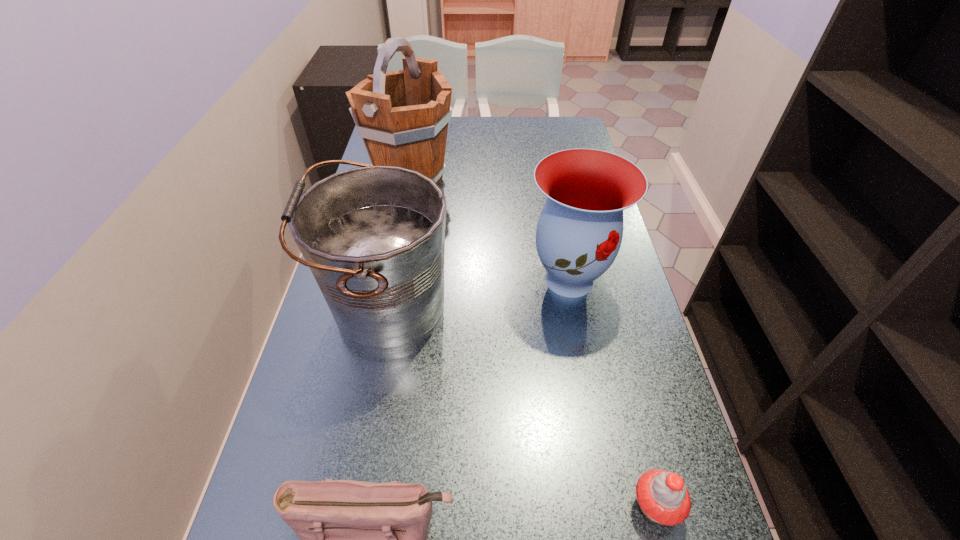
Image resolution: width=960 pixels, height=540 pixels. Find the location of `the farthest object`. the farthest object is located at coordinates (402, 116).

Find the location of a particular element. This screenshot has height=540, width=960. the tallest object is located at coordinates (402, 116).

Locate an element on the screen. This screenshot has height=540, width=960. the nearer bucket is located at coordinates (373, 237).

The height and width of the screenshot is (540, 960). I want to click on vase, so click(x=579, y=232).

Image resolution: width=960 pixels, height=540 pixels. I want to click on cupcake, so click(x=662, y=496).

This screenshot has width=960, height=540. In order to click on vacant space located 0.300m on the front of the farther bucket in this screenshot , I will do `click(391, 278)`.

This screenshot has width=960, height=540. Find the location of `blank area located on the front of the shorter bucket`. blank area located on the front of the shorter bucket is located at coordinates (367, 447).

The image size is (960, 540). Identify the location of vacant region located 0.280m on the back of the vase. (552, 190).

This screenshot has width=960, height=540. What are the coordinates of `free spot located on the left of the cupcake` in the screenshot? It's located at (455, 505).

You are a GUI agent. You are given a task and a screenshot of the screen. Output one action in this format:
    pyautogui.click(x=<x>, y=<y>)
    Task: Click on the vase that is at the right edge
    
    Given the screenshot: What is the action you would take?
    tap(579, 232)